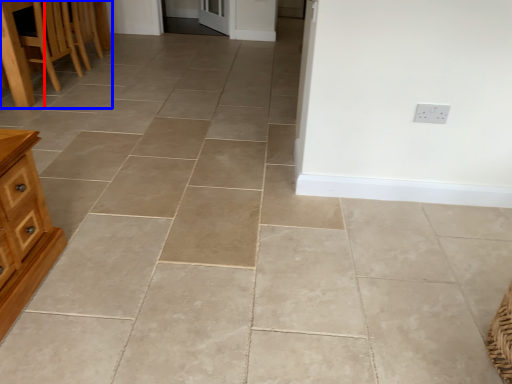
Question: Among these objects, which one is nearest to the camera, table (highlighted by a red box) or furniture (highlighted by a blue box)?

Choices:
 (A) table
 (B) furniture

Answer: (B)